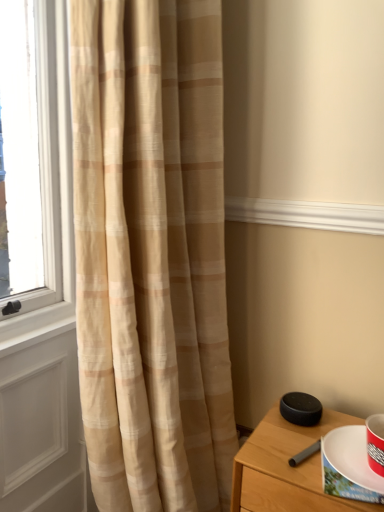
Question: Should I look upward or downward to see translucent beige curtain at left?

Choices:
 (A) up
 (B) down

Answer: (B)

Question: Is beige textured curtain at left inside translucent beige curtain at left?

Choices:
 (A) yes
 (B) no

Answer: (B)

Question: From the image's perspective, is translucent beige curtain at left below beige textured curtain at left?

Choices:
 (A) no
 (B) yes

Answer: (B)

Question: Is translucent beige curtain at left shorter than beige textured curtain at left?

Choices:
 (A) yes
 (B) no

Answer: (A)

Question: From a real-world perspective, is translucent beige curtain at left located higher than beige textured curtain at left?

Choices:
 (A) yes
 (B) no

Answer: (B)

Question: Could you tell me if translucent beige curtain at left is turned towards beige textured curtain at left?

Choices:
 (A) no
 (B) yes

Answer: (B)

Question: Considering the relative positions of translucent beige curtain at left and beige textured curtain at left in the image provided, is translucent beige curtain at left to the right of beige textured curtain at left from the viewer's perspective?

Choices:
 (A) no
 (B) yes

Answer: (A)

Question: Is white paper plate at lower right taller than beige textured curtain at left?

Choices:
 (A) yes
 (B) no

Answer: (B)

Question: Can you confirm if white paper plate at lower right is positioned to the left of beige textured curtain at left?

Choices:
 (A) no
 (B) yes

Answer: (A)

Question: From the image's perspective, is white paper plate at lower right under beige textured curtain at left?

Choices:
 (A) no
 (B) yes

Answer: (B)

Question: Does white paper plate at lower right have a lesser height compared to beige textured curtain at left?

Choices:
 (A) no
 (B) yes

Answer: (B)

Question: Does white paper plate at lower right lie behind beige textured curtain at left?

Choices:
 (A) yes
 (B) no

Answer: (A)

Question: Is white paper plate at lower right completely or partially outside of beige textured curtain at left?

Choices:
 (A) no
 (B) yes

Answer: (B)

Question: Is black matte speaker at lower right outside beige textured curtain at left?

Choices:
 (A) yes
 (B) no

Answer: (A)